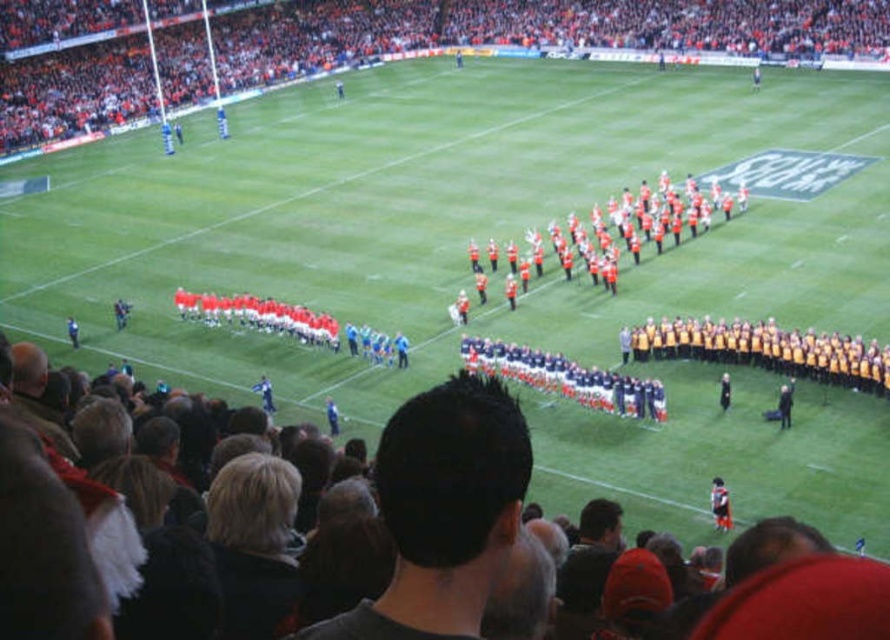
Question: Which point is closer to the camera?

Choices:
 (A) orange fabric crowd at upper left
 (B) orange reflective uniforms at center

Answer: (B)

Question: Can you confirm if dark hair at center is wider than orange reflective uniforms at center?

Choices:
 (A) no
 (B) yes

Answer: (A)

Question: Which of the following is the farthest from the observer?

Choices:
 (A) (475, 268)
 (B) (512, 534)

Answer: (A)

Question: Among these objects, which one is nearest to the camera?

Choices:
 (A) orange reflective uniforms at center
 (B) orange fabric crowd at upper left

Answer: (A)

Question: Is orange fabric crowd at upper left smaller than orange reflective uniforms at center?

Choices:
 (A) no
 (B) yes

Answer: (A)

Question: Is orange fabric crowd at upper left positioned at the back of orange reflective uniforms at center?

Choices:
 (A) no
 (B) yes

Answer: (B)